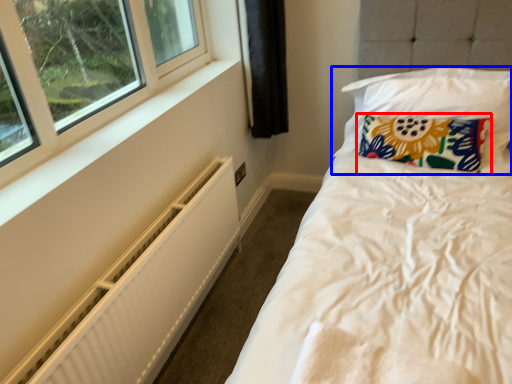
Question: Which object appears closest to the camera in this image, pillow (highlighted by a red box) or pillow (highlighted by a blue box)?

Choices:
 (A) pillow
 (B) pillow

Answer: (B)